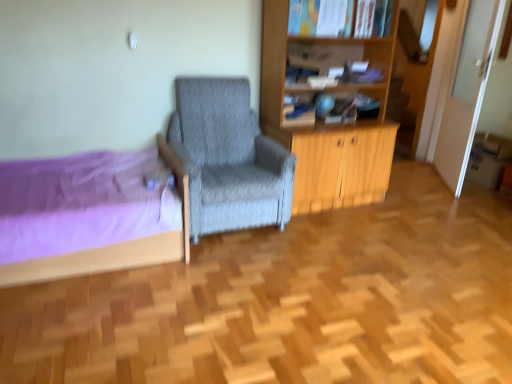
The height and width of the screenshot is (384, 512). I want to click on matte blue book at upper center, the 2th book from the right, so click(298, 111).

In order to click on gray fabric chair at center in this screenshot , I will do `click(228, 158)`.

Is matte blue book at upper center, which is the 1th book in bottom-to-top order, directly adjacent to gray fabric chair at center?

No, matte blue book at upper center, which is the 1th book in bottom-to-top order, is not in contact with gray fabric chair at center.

Which is less distant, (297,107) or (204,126)?

The point (204,126) is closer.

From a real-world perspective, who is located lower, matte blue book at upper center, marked as the 2th book in a top-to-bottom arrangement, or gray fabric chair at center?

gray fabric chair at center is physically lower.

From the image's perspective, which is below, matte blue book at upper center, the 2th book from the right, or gray fabric chair at center?

gray fabric chair at center is shown below in the image.

In the scene shown: From a real-world perspective, is matte blue book at upper center, which is the 1th book in bottom-to-top order, positioned over purple fabric bed at left based on gravity?

Indeed, from a real-world perspective, matte blue book at upper center, which is the 1th book in bottom-to-top order, stands above purple fabric bed at left.

Which point is more forward, (301, 111) or (86, 177)?

The point (86, 177) is in front.

Is matte blue book at upper center, which is counted as the 1th book, starting from the left, surrounding purple fabric bed at left?

No.

In the image, there is a hardcover book at upper center, which ranks as the first book in right-to-left order. At what (x,y) coordinates should I click in order to perform the action: click on chair below it (from the image's perspective). Please return your answer as a coordinate pair (x, y). This screenshot has width=512, height=384. Looking at the image, I should click on (228, 158).

In terms of width, does gray fabric chair at center look wider or thinner when compared to hardcover book at upper center, the 1th book from the top?

Clearly, gray fabric chair at center has more width compared to hardcover book at upper center, the 1th book from the top.

Between gray fabric chair at center and hardcover book at upper center, the 2th book from the bottom, which one has less height?

hardcover book at upper center, the 2th book from the bottom.

Consider the image. Is gray fabric chair at center located outside hardcover book at upper center, which is the 2th book from left to right?

Absolutely, gray fabric chair at center is external to hardcover book at upper center, which is the 2th book from left to right.

Is matte blue book at upper center, which is the 1th book in bottom-to-top order, spatially inside hardcover book at upper center, which is the 2th book from left to right, or outside of it?

matte blue book at upper center, which is the 1th book in bottom-to-top order, is not inside hardcover book at upper center, which is the 2th book from left to right, it's outside.

Considering the relative sizes of matte blue book at upper center, marked as the 2th book in a top-to-bottom arrangement, and hardcover book at upper center, the 1th book from the top, in the image provided, is matte blue book at upper center, marked as the 2th book in a top-to-bottom arrangement, smaller than hardcover book at upper center, the 1th book from the top,?

Indeed, matte blue book at upper center, marked as the 2th book in a top-to-bottom arrangement, has a smaller size compared to hardcover book at upper center, the 1th book from the top.

From a real-world perspective, is matte blue book at upper center, the 2th book from the right, physically above hardcover book at upper center, the 2th book from the bottom?

Incorrect, from a real-world perspective, matte blue book at upper center, the 2th book from the right, is lower than hardcover book at upper center, the 2th book from the bottom.

Find the location of `book below the hardcover book at upper center, which is the 2th book from left to right (from a real-world perspective)`. book below the hardcover book at upper center, which is the 2th book from left to right (from a real-world perspective) is located at coordinates (298, 111).

Is hardcover book at upper center, the 2th book from the bottom, bigger or smaller than purple fabric bed at left?

Considering their sizes, hardcover book at upper center, the 2th book from the bottom, takes up less space than purple fabric bed at left.

From the image's perspective, is hardcover book at upper center, which ranks as the first book in right-to-left order, over purple fabric bed at left?

Yes, from the image's perspective, hardcover book at upper center, which ranks as the first book in right-to-left order, is above purple fabric bed at left.

Is purple fabric bed at left inside hardcover book at upper center, which ranks as the first book in right-to-left order?

That's incorrect, purple fabric bed at left is not inside hardcover book at upper center, which ranks as the first book in right-to-left order.

How different are the orientations of hardcover book at upper center, which is the 2th book from left to right, and purple fabric bed at left in degrees?

87.3 degrees separate the facing orientations of hardcover book at upper center, which is the 2th book from left to right, and purple fabric bed at left.

From a real-world perspective, who is located higher, purple fabric bed at left or matte blue book at upper center, which is the 1th book in bottom-to-top order?

matte blue book at upper center, which is the 1th book in bottom-to-top order, from a real-world perspective.

Does purple fabric bed at left have a greater width compared to matte blue book at upper center, which is counted as the 1th book, starting from the left?

Yes, purple fabric bed at left is wider than matte blue book at upper center, which is counted as the 1th book, starting from the left.

Is purple fabric bed at left positioned beyond the bounds of matte blue book at upper center, the 2th book from the right?

Absolutely, purple fabric bed at left is external to matte blue book at upper center, the 2th book from the right.

Does point (9, 267) come behind point (296, 112)?

That is False.

Measure the distance between purple fabric bed at left and hardcover book at upper center, which is the 2th book from left to right.

purple fabric bed at left and hardcover book at upper center, which is the 2th book from left to right, are 5.55 feet apart.

From the image's perspective, is purple fabric bed at left under hardcover book at upper center, the 1th book from the top?

Correct, purple fabric bed at left appears lower than hardcover book at upper center, the 1th book from the top, in the image.

Does purple fabric bed at left appear on the left side of hardcover book at upper center, which is the 2th book from left to right?

Yes, purple fabric bed at left is to the left of hardcover book at upper center, which is the 2th book from left to right.

Consider the image. Is purple fabric bed at left located outside hardcover book at upper center, the 1th book from the top?

Indeed, purple fabric bed at left is completely outside hardcover book at upper center, the 1th book from the top.

Find the location of `chair located underneath the matte blue book at upper center, which is counted as the 1th book, starting from the left (from a real-world perspective)`. chair located underneath the matte blue book at upper center, which is counted as the 1th book, starting from the left (from a real-world perspective) is located at coordinates (228, 158).

From a real-world perspective, starting from the purple fabric bed at left, which book is the 1st one vertically above it? Please provide its 2D coordinates.

[(298, 111)]

Considering their positions, is purple fabric bed at left positioned further to hardcover book at upper center, which ranks as the first book in right-to-left order, than matte blue book at upper center, which is counted as the 1th book, starting from the left?

The object further to hardcover book at upper center, which ranks as the first book in right-to-left order, is purple fabric bed at left.

From the image, which object appears to be farther from hardcover book at upper center, the 2th book from the bottom, gray fabric chair at center or matte blue book at upper center, which is counted as the 1th book, starting from the left?

gray fabric chair at center.

Based on their spatial positions, is hardcover book at upper center, which is the 2th book from left to right, or matte blue book at upper center, the 2th book from the right, closer to gray fabric chair at center?

Based on the image, matte blue book at upper center, the 2th book from the right, appears to be nearer to gray fabric chair at center.

Looking at the image, which one is located further to matte blue book at upper center, which is the 1th book in bottom-to-top order, gray fabric chair at center or hardcover book at upper center, the 2th book from the bottom?

hardcover book at upper center, the 2th book from the bottom, is positioned further to the anchor matte blue book at upper center, which is the 1th book in bottom-to-top order.

Which object lies further to the anchor point hardcover book at upper center, which is the 2th book from left to right, matte blue book at upper center, marked as the 2th book in a top-to-bottom arrangement, or purple fabric bed at left?

purple fabric bed at left is further to hardcover book at upper center, which is the 2th book from left to right.

Considering their positions, is purple fabric bed at left positioned further to matte blue book at upper center, the 2th book from the right, than gray fabric chair at center?

Among the two, purple fabric bed at left is located further to matte blue book at upper center, the 2th book from the right.

When comparing their distances from purple fabric bed at left, does matte blue book at upper center, which is the 1th book in bottom-to-top order, or hardcover book at upper center, the 1th book from the top, seem further?

hardcover book at upper center, the 1th book from the top, is positioned further to the anchor purple fabric bed at left.

Which object lies further to the anchor point gray fabric chair at center, matte blue book at upper center, the 2th book from the right, or hardcover book at upper center, the 1th book from the top?

hardcover book at upper center, the 1th book from the top, is positioned further to the anchor gray fabric chair at center.

Identify the location of book located between purple fabric bed at left and hardcover book at upper center, which ranks as the first book in right-to-left order, in the left-right direction. This screenshot has width=512, height=384. (298, 111).

The height and width of the screenshot is (384, 512). I want to click on chair between purple fabric bed at left and hardcover book at upper center, the 1th book from the top, from left to right, so click(x=228, y=158).

Locate an element on the screen. chair situated between purple fabric bed at left and matte blue book at upper center, which is counted as the 1th book, starting from the left, from left to right is located at coordinates (228, 158).

Locate an element on the screen. book between hardcover book at upper center, which is the 2th book from left to right, and gray fabric chair at center vertically is located at coordinates (298, 111).